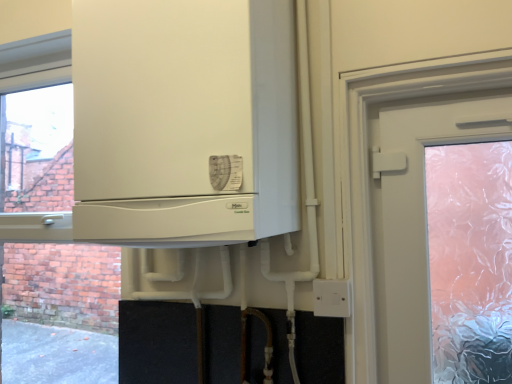
Question: Would you say white plastic electric outlet at lower right is a long distance from white matte cabinet at center?

Choices:
 (A) no
 (B) yes

Answer: (A)

Question: Are white plastic electric outlet at lower right and white matte cabinet at center making contact?

Choices:
 (A) no
 (B) yes

Answer: (A)

Question: From a real-world perspective, is white plastic electric outlet at lower right located beneath white matte cabinet at center?

Choices:
 (A) yes
 (B) no

Answer: (A)

Question: Can you confirm if white plastic electric outlet at lower right is thinner than white matte cabinet at center?

Choices:
 (A) yes
 (B) no

Answer: (A)

Question: From the image's perspective, is white plastic electric outlet at lower right located above white matte cabinet at center?

Choices:
 (A) yes
 (B) no

Answer: (B)

Question: Is white plastic electric outlet at lower right at the left side of white matte cabinet at center?

Choices:
 (A) yes
 (B) no

Answer: (B)

Question: Can white plastic electric outlet at lower right be found inside white matte cabinet at center?

Choices:
 (A) no
 (B) yes

Answer: (A)

Question: Considering the relative sizes of white matte cabinet at center and white plastic electric outlet at lower right in the image provided, is white matte cabinet at center wider than white plastic electric outlet at lower right?

Choices:
 (A) no
 (B) yes

Answer: (B)

Question: Can you confirm if white matte cabinet at center is smaller than white plastic electric outlet at lower right?

Choices:
 (A) yes
 (B) no

Answer: (B)

Question: Can you confirm if white matte cabinet at center is bigger than white plastic electric outlet at lower right?

Choices:
 (A) no
 (B) yes

Answer: (B)

Question: Does white matte cabinet at center have a lesser width compared to white plastic electric outlet at lower right?

Choices:
 (A) yes
 (B) no

Answer: (B)

Question: Does white matte cabinet at center lie behind white plastic electric outlet at lower right?

Choices:
 (A) yes
 (B) no

Answer: (B)

Question: From the image's perspective, is white matte cabinet at center positioned above or below white plastic electric outlet at lower right?

Choices:
 (A) below
 (B) above

Answer: (B)